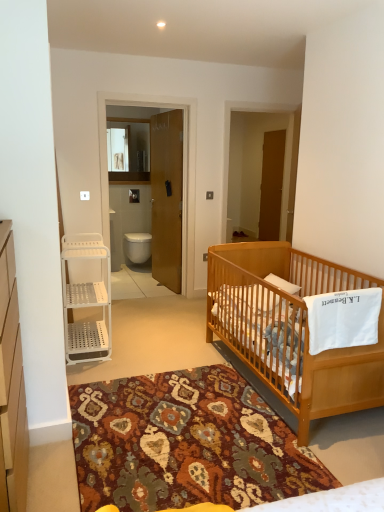
Question: Is white plastic shelving unit at left bigger or smaller than patterned carpet at center?

Choices:
 (A) big
 (B) small

Answer: (B)

Question: From their relative heights in the image, would you say white plastic shelving unit at left is taller or shorter than patterned carpet at center?

Choices:
 (A) tall
 (B) short

Answer: (A)

Question: Based on their relative distances, which object is farther from the patterned carpet at center?

Choices:
 (A) brown wooden screen door at center
 (B) light brown wooden crib at lower right
 (C) white glossy toilet at center
 (D) white plastic shelving unit at left
 (E) white plastic shelf at left

Answer: (A)

Question: Which is farther from the white glossy toilet at center?

Choices:
 (A) brown wooden door at center
 (B) light brown wooden crib at lower right
 (C) brown wooden screen door at center
 (D) patterned carpet at center
 (E) white plastic shelving unit at left

Answer: (E)